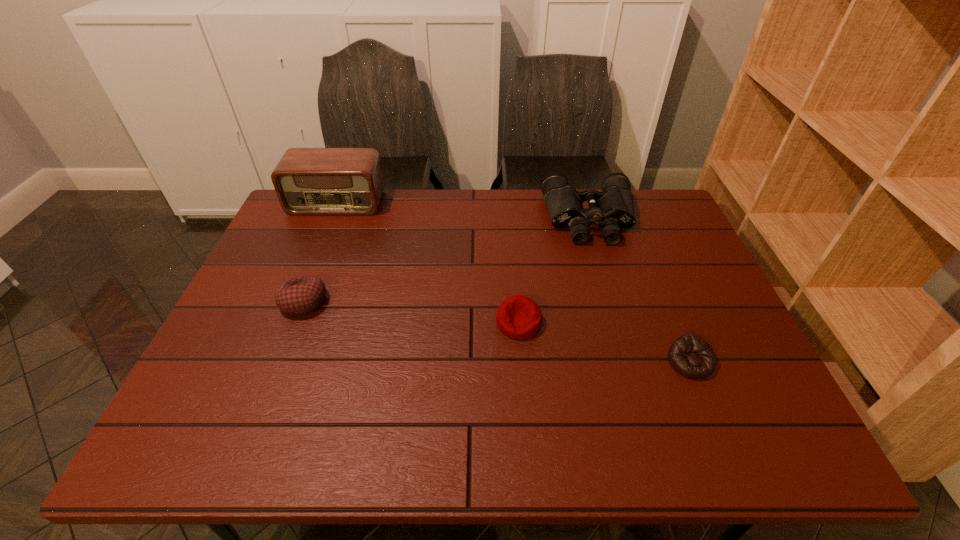
This screenshot has height=540, width=960. Find the location of `vacant space that satisfies the following two spatial constraints: 1. through the eyepieces of the second tallest object; 2. on the right side of the shortest object`. vacant space that satisfies the following two spatial constraints: 1. through the eyepieces of the second tallest object; 2. on the right side of the shortest object is located at coordinates coord(631,362).

This screenshot has height=540, width=960. Find the location of `vacant area in the image that satisfies the following two spatial constraints: 1. on the front panel of the leftmost beanbag; 2. on the right side of the tallest object`. vacant area in the image that satisfies the following two spatial constraints: 1. on the front panel of the leftmost beanbag; 2. on the right side of the tallest object is located at coordinates (297, 301).

At what (x,y) coordinates should I click in order to perform the action: click on free space that satisfies the following two spatial constraints: 1. on the front panel of the tallest object; 2. on the left side of the shortest beanbag. Please return your answer as a coordinate pair (x, y). Image resolution: width=960 pixels, height=540 pixels. Looking at the image, I should click on (272, 362).

I want to click on vacant point that satisfies the following two spatial constraints: 1. on the front panel of the leftmost beanbag; 2. on the right side of the tallest object, so click(x=297, y=301).

Identify the location of vacant point that satisfies the following two spatial constraints: 1. on the seat area of the second beanbag from right to left; 2. on the left side of the rightmost beanbag. This screenshot has height=540, width=960. (521, 362).